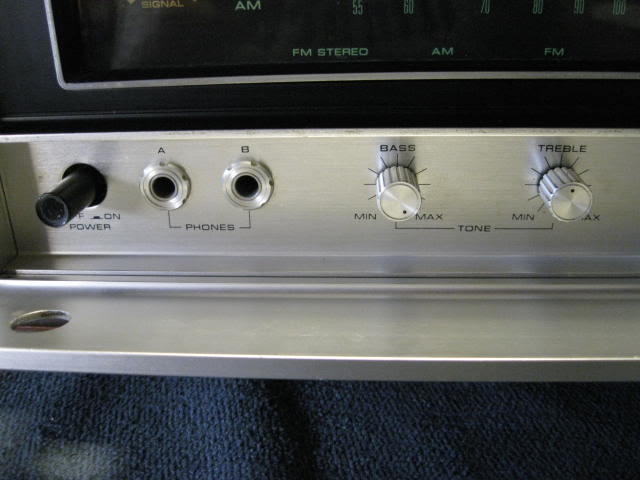
Image resolution: width=640 pixels, height=480 pixels. Find the location of `knob`. knob is located at coordinates (402, 200).